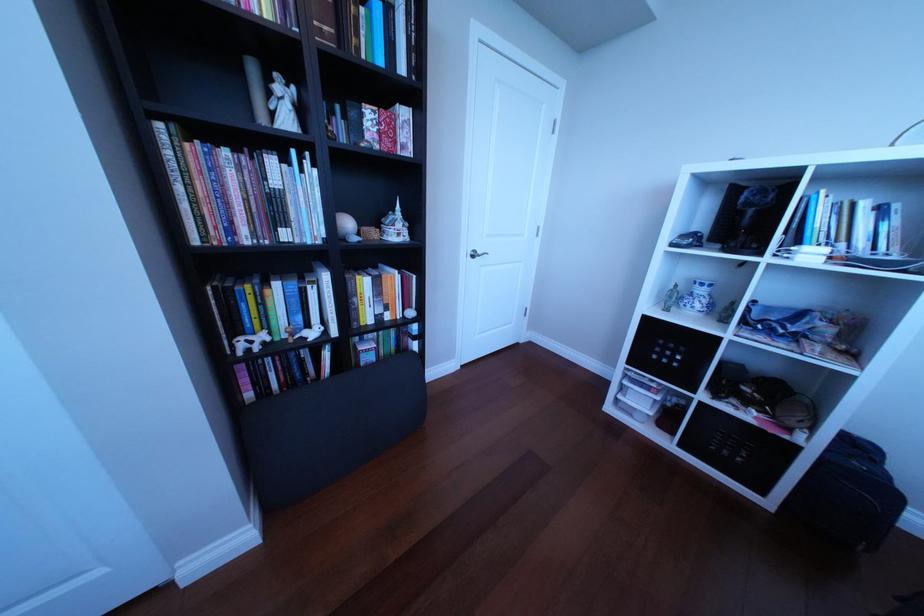
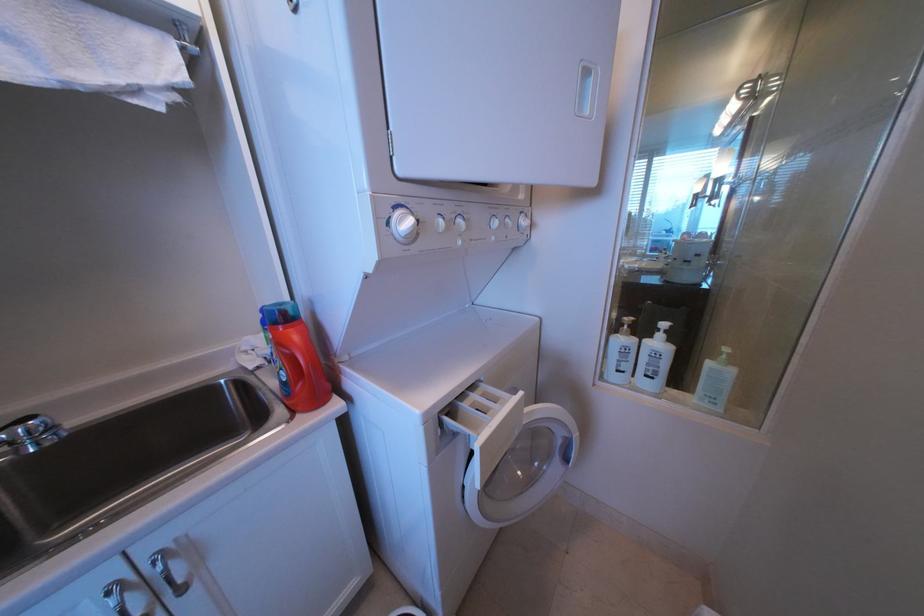
Question: What movement of the cameraman would produce the second image?

Choices:
 (A) Left
 (B) Right
 (C) Forward
 (D) Backward

Answer: (B)